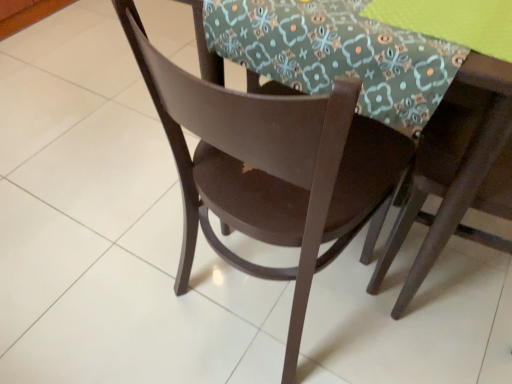
Locate an element on the screen. vacant space underneath matte brown chair at upper right, marked as the 2th chair in a left-to-right arrangement (from a real-world perspective) is located at coordinates point(474,276).